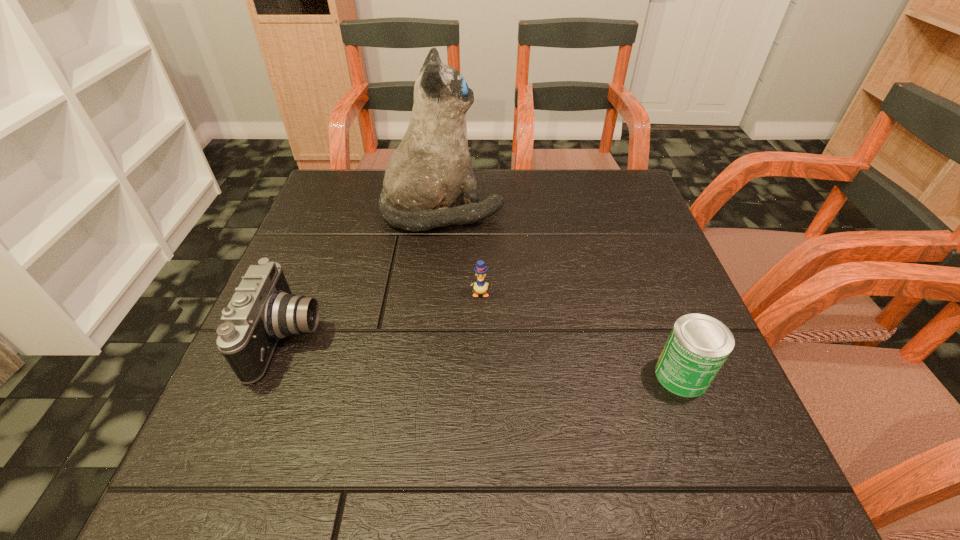
Where is `vacant region that satisfies the following two spatial constraints: 1. on the front-facing side of the camera; 2. on the right side of the third tallest object`? vacant region that satisfies the following two spatial constraints: 1. on the front-facing side of the camera; 2. on the right side of the third tallest object is located at coordinates (274, 375).